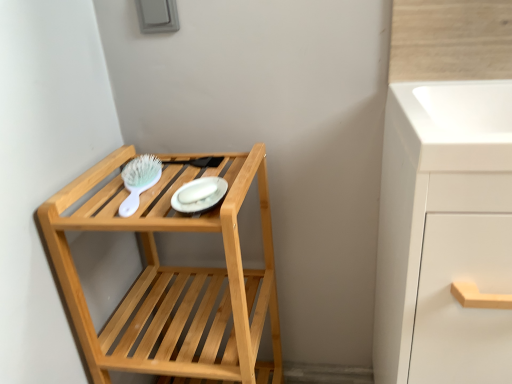
Question: Does white matte cabinet at right lie behind green plastic brush at upper left?

Choices:
 (A) yes
 (B) no

Answer: (B)

Question: Is white matte cabinet at right at the right side of green plastic brush at upper left?

Choices:
 (A) no
 (B) yes

Answer: (B)

Question: Is white matte cabinet at right oriented away from green plastic brush at upper left?

Choices:
 (A) no
 (B) yes

Answer: (A)

Question: From the image's perspective, is white matte cabinet at right over green plastic brush at upper left?

Choices:
 (A) yes
 (B) no

Answer: (B)

Question: Does white matte cabinet at right have a larger size compared to green plastic brush at upper left?

Choices:
 (A) no
 (B) yes

Answer: (B)

Question: Is white matte cabinet at right positioned in front of green plastic brush at upper left?

Choices:
 (A) no
 (B) yes

Answer: (B)

Question: Is natural wood shelf at left taller than white matte cabinet at right?

Choices:
 (A) yes
 (B) no

Answer: (B)

Question: Can you confirm if natural wood shelf at left is shorter than white matte cabinet at right?

Choices:
 (A) yes
 (B) no

Answer: (A)

Question: Does natural wood shelf at left lie behind white matte cabinet at right?

Choices:
 (A) no
 (B) yes

Answer: (B)

Question: Is natural wood shelf at left turned away from white matte cabinet at right?

Choices:
 (A) no
 (B) yes

Answer: (A)

Question: Does natural wood shelf at left have a lesser width compared to white matte cabinet at right?

Choices:
 (A) yes
 (B) no

Answer: (A)

Question: Considering the relative positions of natural wood shelf at left and white matte cabinet at right in the image provided, is natural wood shelf at left to the right of white matte cabinet at right from the viewer's perspective?

Choices:
 (A) yes
 (B) no

Answer: (B)

Question: From a real-world perspective, is white matte cabinet at right beneath natural wood shelf at left?

Choices:
 (A) no
 (B) yes

Answer: (A)